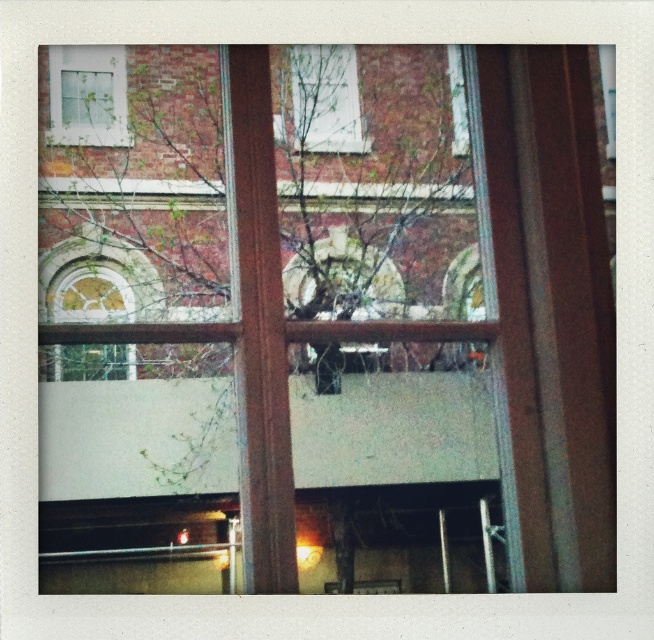
Locate an element on the screen. clear glass window at upper center is located at coordinates (324, 99).

Can you confirm if clear glass window at upper center is smaller than white matte window at upper left?

Indeed, clear glass window at upper center has a smaller size compared to white matte window at upper left.

Image resolution: width=654 pixels, height=640 pixels. What do you see at coordinates (324, 99) in the screenshot?
I see `clear glass window at upper center` at bounding box center [324, 99].

Locate an element on the screen. clear glass window at upper center is located at coordinates (324, 99).

Can you confirm if clear glass window at upper center is thinner than transparent glass window at upper center?

Incorrect, clear glass window at upper center's width is not less than transparent glass window at upper center's.

Is clear glass window at upper center positioned at the back of transparent glass window at upper center?

No, clear glass window at upper center is in front of transparent glass window at upper center.

Find the location of a particular element. The width and height of the screenshot is (654, 640). clear glass window at upper center is located at coordinates (324, 99).

Is point (300, 196) closer to camera compared to point (460, 83)?

No, it is behind (460, 83).

Between green leafy tree at center and transparent glass window at upper center, which one is positioned lower?

green leafy tree at center is below.

Between point (69, 346) and point (460, 54), which one is positioned in front?

Point (460, 54) is more forward.

Where is `green leafy tree at center`? Image resolution: width=654 pixels, height=640 pixels. green leafy tree at center is located at coordinates (264, 280).